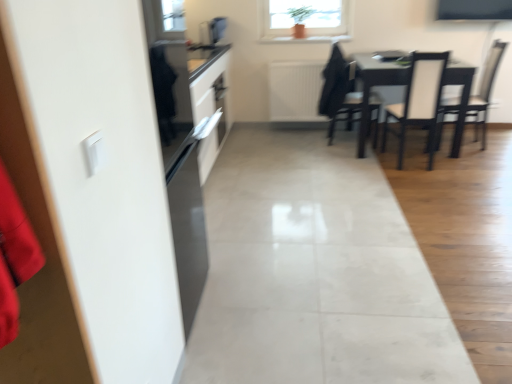
Question: Considering the relative positions of black matte sweatshirt at upper center and satin black microwave at upper center in the image provided, is black matte sweatshirt at upper center in front of satin black microwave at upper center?

Choices:
 (A) no
 (B) yes

Answer: (B)

Question: Can satin black microwave at upper center be found inside black matte sweatshirt at upper center?

Choices:
 (A) no
 (B) yes

Answer: (A)

Question: Can you confirm if black matte sweatshirt at upper center is positioned to the left of satin black microwave at upper center?

Choices:
 (A) yes
 (B) no

Answer: (B)

Question: Is black matte sweatshirt at upper center turned away from satin black microwave at upper center?

Choices:
 (A) no
 (B) yes

Answer: (B)

Question: Is black matte sweatshirt at upper center at the right side of satin black microwave at upper center?

Choices:
 (A) no
 (B) yes

Answer: (B)

Question: Is black matte sweatshirt at upper center aimed at satin black microwave at upper center?

Choices:
 (A) yes
 (B) no

Answer: (B)

Question: Can you confirm if white leather chair at right, the 1th chair when ordered from right to left, is positioned to the right of dark wood chair at center, arranged as the 1th chair when viewed from the left?

Choices:
 (A) yes
 (B) no

Answer: (A)

Question: From a real-world perspective, is white leather chair at right, the 1th chair when ordered from right to left, over dark wood chair at center, arranged as the third chair when viewed from the right?

Choices:
 (A) no
 (B) yes

Answer: (A)

Question: Is white leather chair at right, the third chair from the left, smaller than dark wood chair at center, arranged as the third chair when viewed from the right?

Choices:
 (A) yes
 (B) no

Answer: (B)

Question: Does white leather chair at right, the 1th chair when ordered from right to left, turn towards dark wood chair at center, arranged as the third chair when viewed from the right?

Choices:
 (A) yes
 (B) no

Answer: (A)

Question: Considering the relative sizes of white leather chair at right, the third chair from the left, and dark wood chair at center, arranged as the 1th chair when viewed from the left, in the image provided, is white leather chair at right, the third chair from the left, bigger than dark wood chair at center, arranged as the 1th chair when viewed from the left,?

Choices:
 (A) yes
 (B) no

Answer: (A)

Question: Can you confirm if white leather chair at right, the third chair from the left, is wider than dark wood chair at center, arranged as the third chair when viewed from the right?

Choices:
 (A) no
 (B) yes

Answer: (B)

Question: From the image's perspective, would you say white textured radiator at center is positioned over white leather chair at center, which is the second chair from left to right?

Choices:
 (A) yes
 (B) no

Answer: (A)